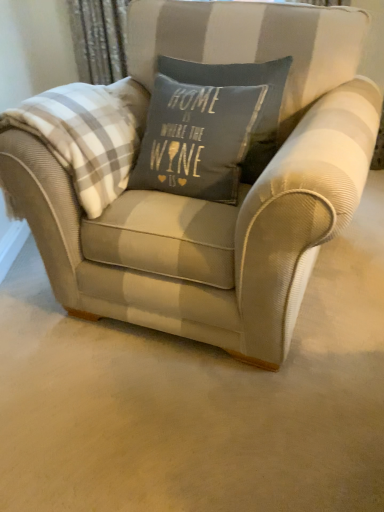
Question: Is textured beige armchair at center smaller than white plaid blanket at left?

Choices:
 (A) yes
 (B) no

Answer: (B)

Question: From the image's perspective, does textured beige armchair at center appear lower than white plaid blanket at left?

Choices:
 (A) yes
 (B) no

Answer: (A)

Question: Does textured beige armchair at center appear on the right side of white plaid blanket at left?

Choices:
 (A) no
 (B) yes

Answer: (B)

Question: Does textured beige armchair at center lie in front of white plaid blanket at left?

Choices:
 (A) yes
 (B) no

Answer: (A)

Question: Is textured beige armchair at center facing away from white plaid blanket at left?

Choices:
 (A) yes
 (B) no

Answer: (B)

Question: Is textured beige armchair at center thinner than white plaid blanket at left?

Choices:
 (A) yes
 (B) no

Answer: (B)

Question: Is white plaid blanket at left aimed at textured beige armchair at center?

Choices:
 (A) yes
 (B) no

Answer: (A)

Question: Considering the relative positions of white plaid blanket at left and textured beige armchair at center in the image provided, is white plaid blanket at left to the left of textured beige armchair at center from the viewer's perspective?

Choices:
 (A) no
 (B) yes

Answer: (B)

Question: Considering the relative sizes of white plaid blanket at left and textured beige armchair at center in the image provided, is white plaid blanket at left smaller than textured beige armchair at center?

Choices:
 (A) yes
 (B) no

Answer: (A)

Question: Is white plaid blanket at left positioned before textured beige armchair at center?

Choices:
 (A) yes
 (B) no

Answer: (B)

Question: Is the depth of white plaid blanket at left greater than that of textured beige armchair at center?

Choices:
 (A) no
 (B) yes

Answer: (B)

Question: From a real-world perspective, is white plaid blanket at left physically below textured beige armchair at center?

Choices:
 (A) no
 (B) yes

Answer: (A)

Question: From the image's perspective, is textured beige armchair at center located above or below white plaid blanket at left?

Choices:
 (A) above
 (B) below

Answer: (B)